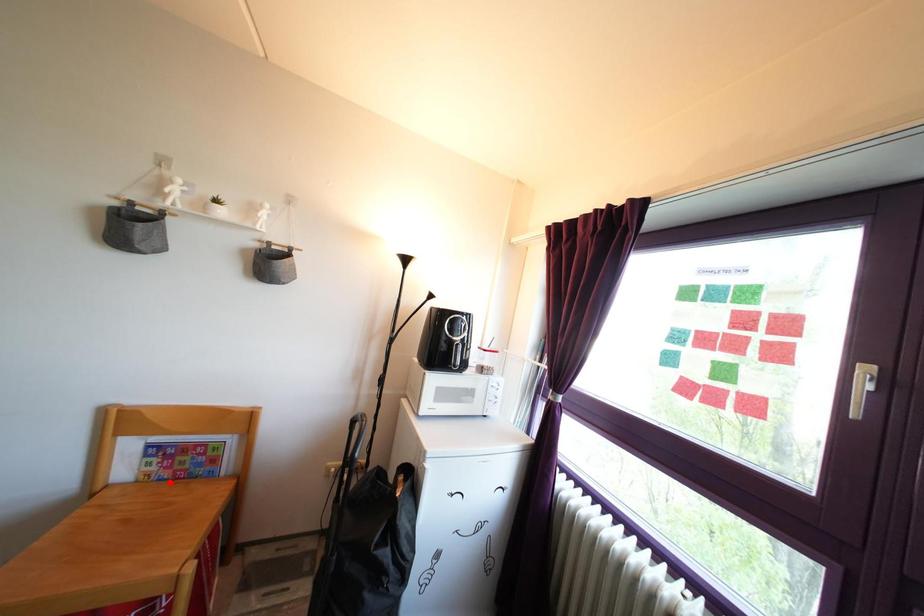
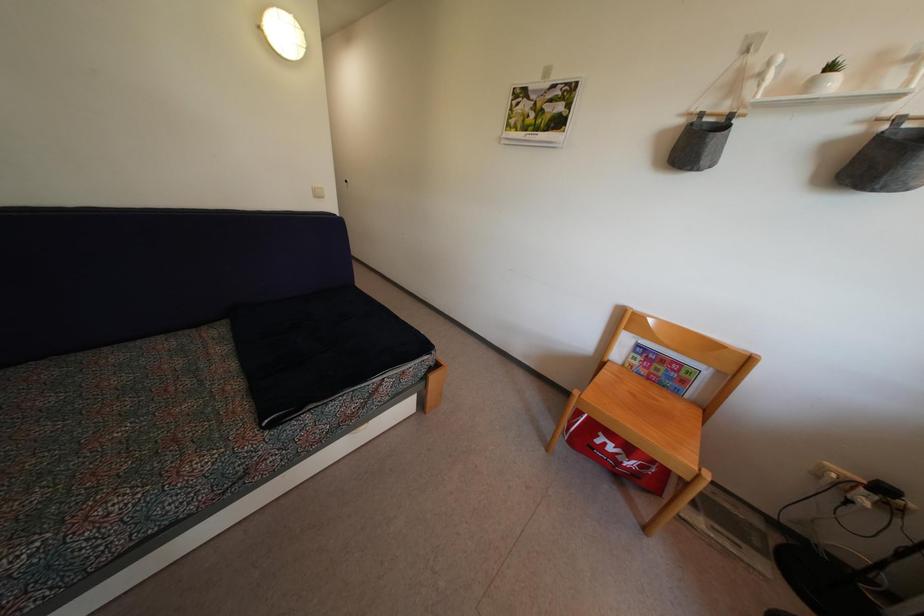
Locate, in the second image, the point that corresponds to the highlighted location in the first image.

(647, 381)